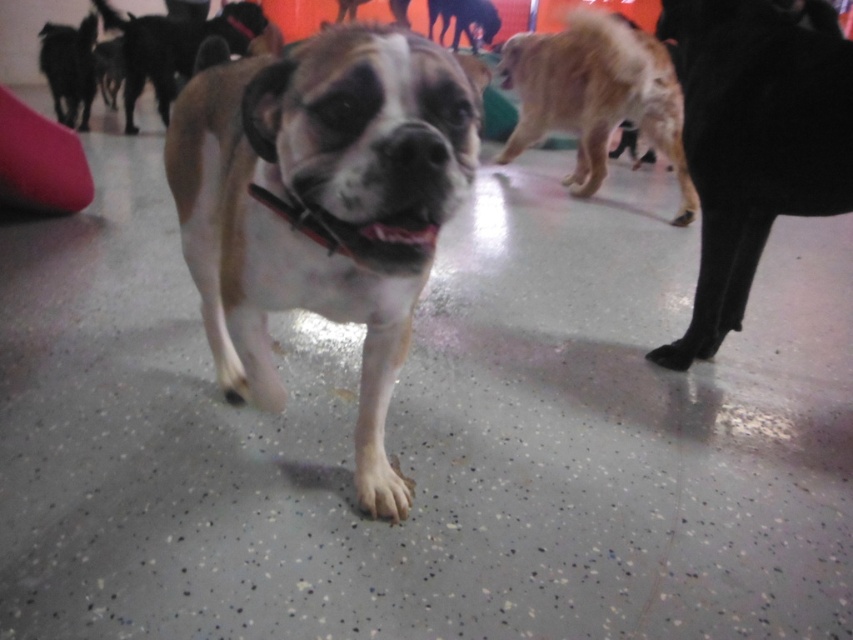
Question: Based on their relative distances, which object is nearer to the white fur dog at center?

Choices:
 (A) brown matte dog at upper left
 (B) black fur dog at upper left

Answer: (A)

Question: Can you confirm if golden fur dog at upper right is smaller than black fur dog at upper left?

Choices:
 (A) no
 (B) yes

Answer: (A)

Question: Based on their relative distances, which object is nearer to the brown matte dog at upper left?

Choices:
 (A) black fur dog at upper left
 (B) black smooth dog at right
 (C) golden fur dog at upper right
 (D) white fur dog at center

Answer: (A)

Question: Which of the following is the farthest from the observer?

Choices:
 (A) white fur dog at center
 (B) black smooth dog at right
 (C) black fur dog at upper left
 (D) brown matte dog at upper left

Answer: (C)

Question: Is white fur dog at center closer to camera compared to brown matte dog at upper left?

Choices:
 (A) no
 (B) yes

Answer: (B)

Question: Does golden fur dog at upper right appear on the left side of black fur dog at upper left?

Choices:
 (A) yes
 (B) no

Answer: (B)